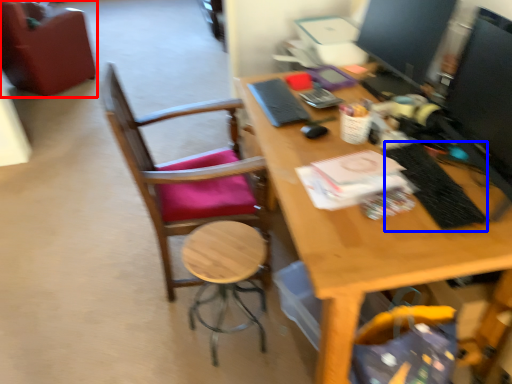
Question: Which point is further to the camera, chair (highlighted by a red box) or laptop keyboard (highlighted by a blue box)?

Choices:
 (A) chair
 (B) laptop keyboard

Answer: (A)